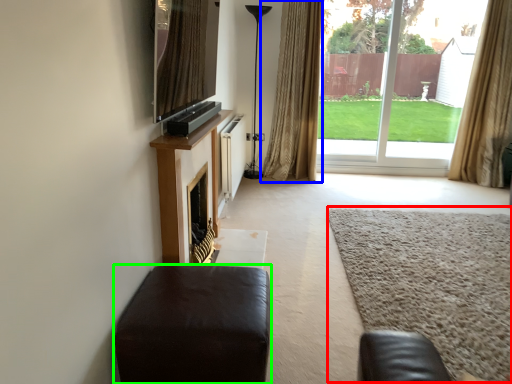
Question: Considering the real-world distances, which object is farthest from plain (highlighted by a red box)? curtain (highlighted by a blue box) or furniture (highlighted by a green box)?

Choices:
 (A) curtain
 (B) furniture

Answer: (A)